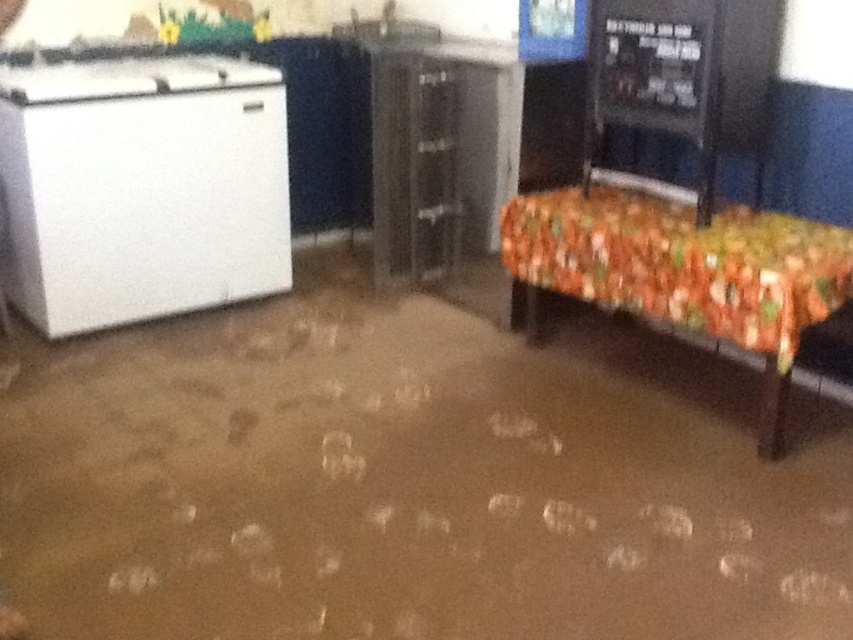
You are a maintenance worker who needs to inspect the white matte refrigerator at left. You are currently standing 1.5 meters away from it. Can you reach the refrigerator without moving closer?

The white matte refrigerator at left is 2.79 meters away from camera. Since you are currently 1.5 meters away from it, you are still 1.29 meters away and need to move closer to reach it.